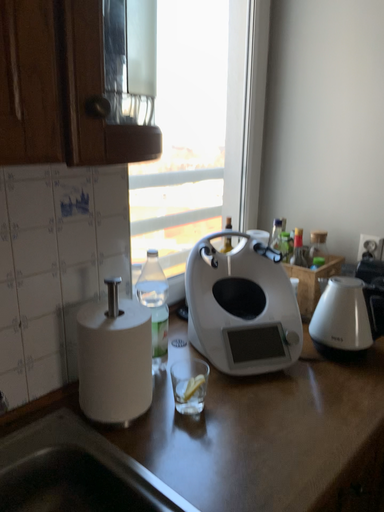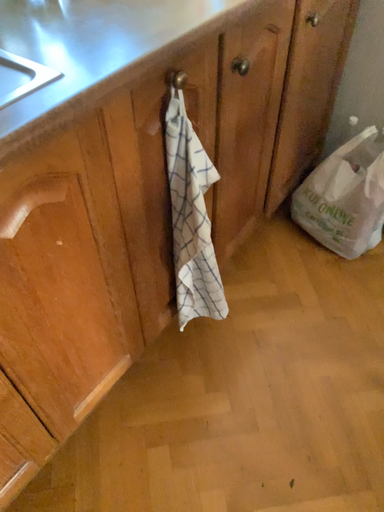
Question: How did the camera likely rotate when shooting the video?

Choices:
 (A) rotated upward
 (B) rotated downward

Answer: (B)